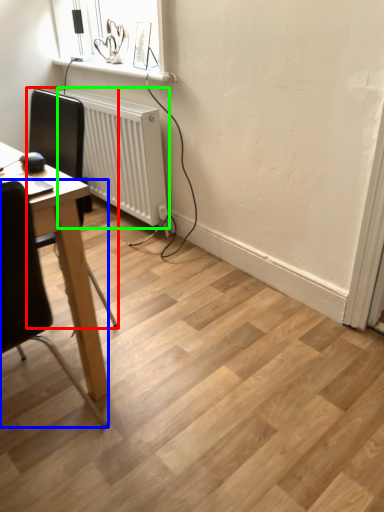
Question: Based on their relative distances, which object is farther from chair (highlighted by a red box)? Choose from chair (highlighted by a blue box) and radiator (highlighted by a green box).

Choices:
 (A) chair
 (B) radiator

Answer: (A)